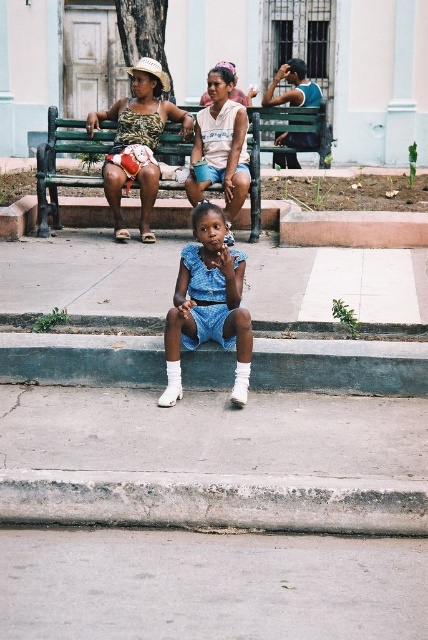
Question: Can you confirm if blue denim dress at center is wider than blue-green fabric shirt at upper right?

Choices:
 (A) no
 (B) yes

Answer: (A)

Question: Is gray concrete curb at lower center thinner than green concrete curb at lower center?

Choices:
 (A) yes
 (B) no

Answer: (A)

Question: Which point is farther from the camera taking this photo?

Choices:
 (A) (187, 193)
 (B) (146, 104)

Answer: (B)

Question: Which object is the farthest from the green wooden bench at center?

Choices:
 (A) gray concrete curb at lower center
 (B) green concrete curb at lower center

Answer: (A)

Question: Is gray concrete curb at lower center thinner than green wooden bench at center?

Choices:
 (A) yes
 (B) no

Answer: (B)

Question: Which object appears closest to the camera in this image?

Choices:
 (A) matte blue dress at center
 (B) matte white tank top at center
 (C) blue denim dress at center
 (D) green wooden bench at center

Answer: (C)